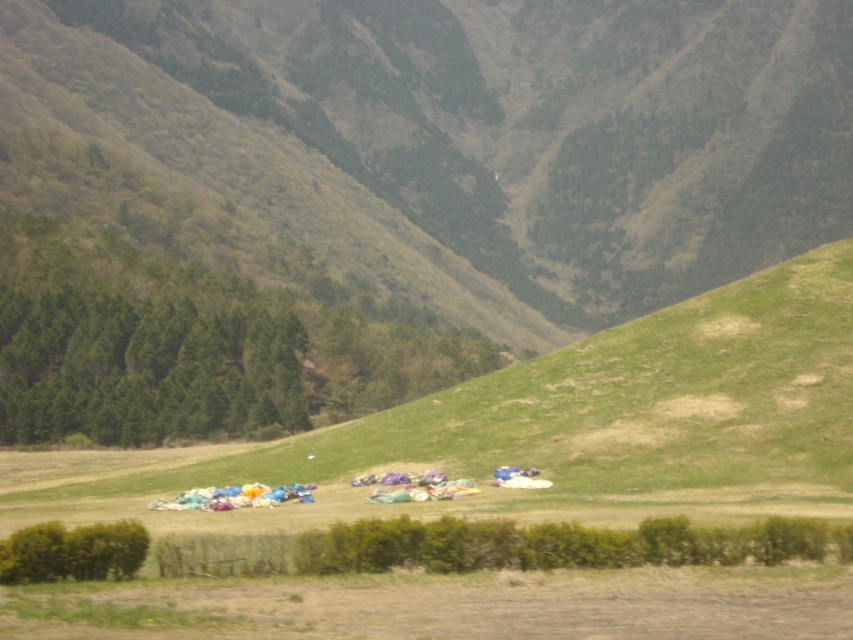
Which of these two, green grassy hillside at center or multicolored fabric at center, stands taller?

green grassy hillside at center is taller.

Who is higher up, green grassy hillside at center or multicolored fabric at center?

green grassy hillside at center is higher up.

The height and width of the screenshot is (640, 853). Describe the element at coordinates (384, 189) in the screenshot. I see `green grassy hillside at center` at that location.

Image resolution: width=853 pixels, height=640 pixels. Identify the location of green grassy hillside at center. (384, 189).

Between point (416, 356) and point (669, 330), which one is positioned behind?

Positioned behind is point (416, 356).

Does green grassy hillside at center come in front of green grassy field at lower center?

No, green grassy hillside at center is behind green grassy field at lower center.

Between point (154, 12) and point (154, 493), which one is positioned in front?

Point (154, 493) is in front.

The image size is (853, 640). Find the location of `green grassy hillside at center`. green grassy hillside at center is located at coordinates (384, 189).

Is green grassy field at lower center below multicolored fabric at center?

Answer: No.

Where is `green grassy field at lower center`? The width and height of the screenshot is (853, 640). green grassy field at lower center is located at coordinates pos(576,424).